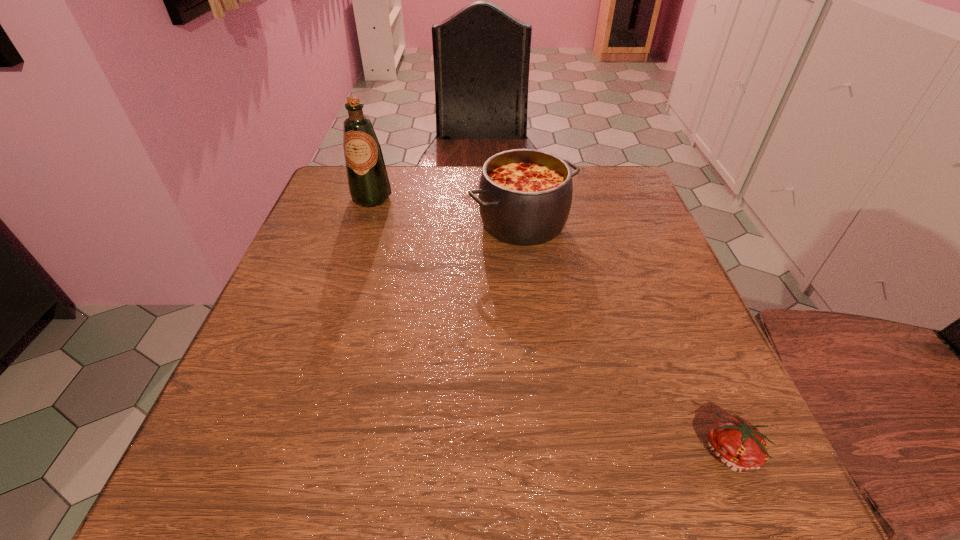
Locate an element on the screen. The image size is (960, 540). vacant area at the far left corner of the desktop is located at coordinates (368, 211).

In the image, there is a desktop. At what (x,y) coordinates should I click in order to perform the action: click on vacant space at the near right corner. Please return your answer as a coordinate pair (x, y). Image resolution: width=960 pixels, height=540 pixels. Looking at the image, I should click on (738, 484).

This screenshot has width=960, height=540. Identify the location of vacant space that's between the second object from left to right and the olive oil. (447, 210).

Image resolution: width=960 pixels, height=540 pixels. What are the coordinates of `free space between the second object from right to left and the nearest object` in the screenshot? It's located at (627, 338).

Identify the location of vacant area that lies between the nearest object and the casserole. The width and height of the screenshot is (960, 540). (627, 338).

At what (x,y) coordinates should I click in order to perform the action: click on unoccupied area between the casserole and the tallest object. Please return your answer as a coordinate pair (x, y). Looking at the image, I should click on (447, 210).

Identify the location of free space between the second object from right to left and the tallest object. This screenshot has height=540, width=960. (447, 210).

What are the coordinates of `free space between the rightmost object and the tallest object` in the screenshot? It's located at (552, 325).

At what (x,y) coordinates should I click in order to perform the action: click on free space that is in between the rightmost object and the second shortest object. Please return your answer as a coordinate pair (x, y). Looking at the image, I should click on (627, 338).

At what (x,y) coordinates should I click in order to perform the action: click on free spot between the nearest object and the tallest object. Please return your answer as a coordinate pair (x, y). This screenshot has width=960, height=540. Looking at the image, I should click on (552, 325).